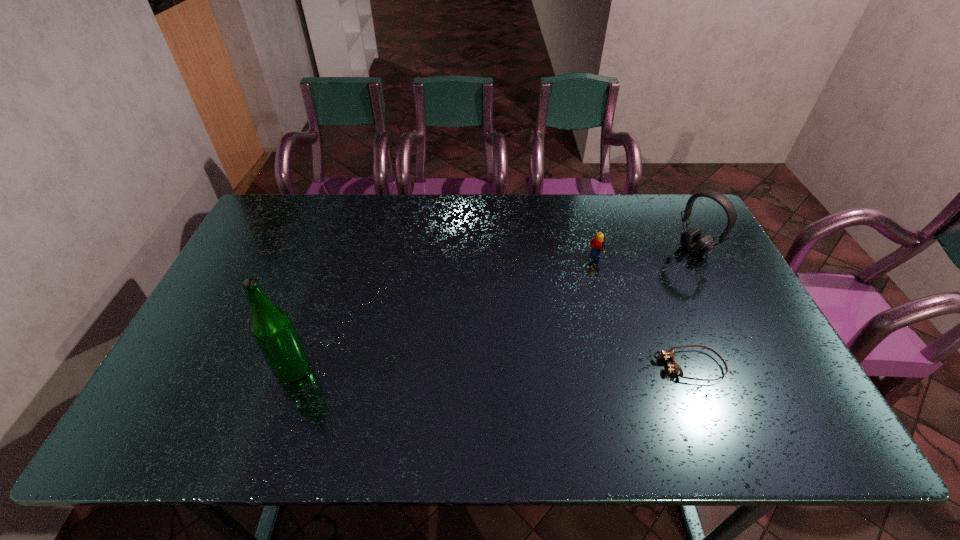
Image resolution: width=960 pixels, height=540 pixels. Find the location of `object situated at the far edge`. object situated at the far edge is located at coordinates (691, 240).

Find the location of a particular element. This screenshot has height=540, width=960. beer bottle present at the near edge is located at coordinates (272, 329).

Locate an element on the screen. goggles that is at the near edge is located at coordinates (673, 367).

You are a GUI agent. You are given a task and a screenshot of the screen. Output one action in this format:
    pyautogui.click(x=<x>, y=<y>)
    Task: Click on the goggles located in the right edge section of the desktop
    
    Given the screenshot: What is the action you would take?
    pyautogui.click(x=673, y=367)

The height and width of the screenshot is (540, 960). Find the location of `headset that is positioned at the right edge`. headset that is positioned at the right edge is located at coordinates (691, 240).

Identify the location of object situated at the far right corner. This screenshot has width=960, height=540. (691, 240).

This screenshot has width=960, height=540. I want to click on object present at the near right corner, so click(673, 367).

At what (x,y) coordinates should I click in order to perform the action: click on free spot at the far edge of the desktop. Please return your answer as a coordinate pair (x, y). The height and width of the screenshot is (540, 960). Looking at the image, I should click on (328, 211).

Identify the location of free point at the left edge. The height and width of the screenshot is (540, 960). (242, 267).

Locate an element on the screen. The height and width of the screenshot is (540, 960). vacant space at the right edge of the desktop is located at coordinates coord(685,253).